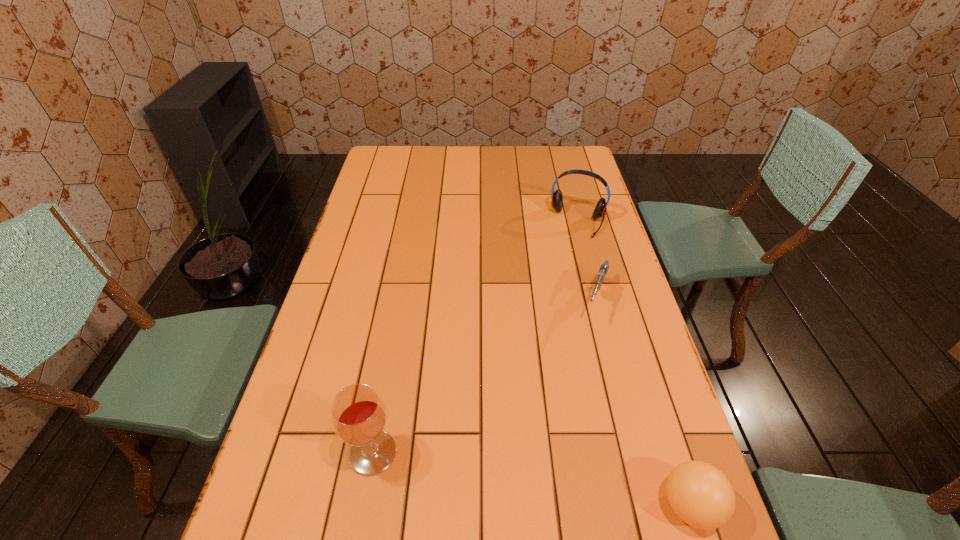
What are the coordinates of `wineglass` in the screenshot? It's located at (358, 414).

Locate an element on the screen. This screenshot has height=540, width=960. ping-pong ball is located at coordinates (700, 494).

The width and height of the screenshot is (960, 540). What are the coordinates of `headset` in the screenshot? It's located at (556, 197).

Locate an element on the screen. gun is located at coordinates (603, 270).

Identify the location of free space located 0.150m on the left of the leftmost object. (280, 453).

You are a GUI agent. You are given a task and a screenshot of the screen. Output one action in this format:
    pyautogui.click(x=<x>, y=<y>)
    Task: Click on the vacant space situated with the microphone attached to the side of the farthest object
    This screenshot has height=540, width=960.
    Given the screenshot: What is the action you would take?
    pyautogui.click(x=564, y=267)

Identify the location of vacant position located with the microphone attached to the side of the farthest object. This screenshot has height=540, width=960. (564, 267).

The width and height of the screenshot is (960, 540). In order to click on free space located 0.150m with the microphone attached to the side of the farthest object in this screenshot , I will do `click(564, 265)`.

Find the location of a particular element. The image size is (960, 540). blank area located 0.090m at the barrel of the second farthest object is located at coordinates (586, 348).

The width and height of the screenshot is (960, 540). I want to click on vacant area situated at the barrel of the second farthest object, so click(549, 451).